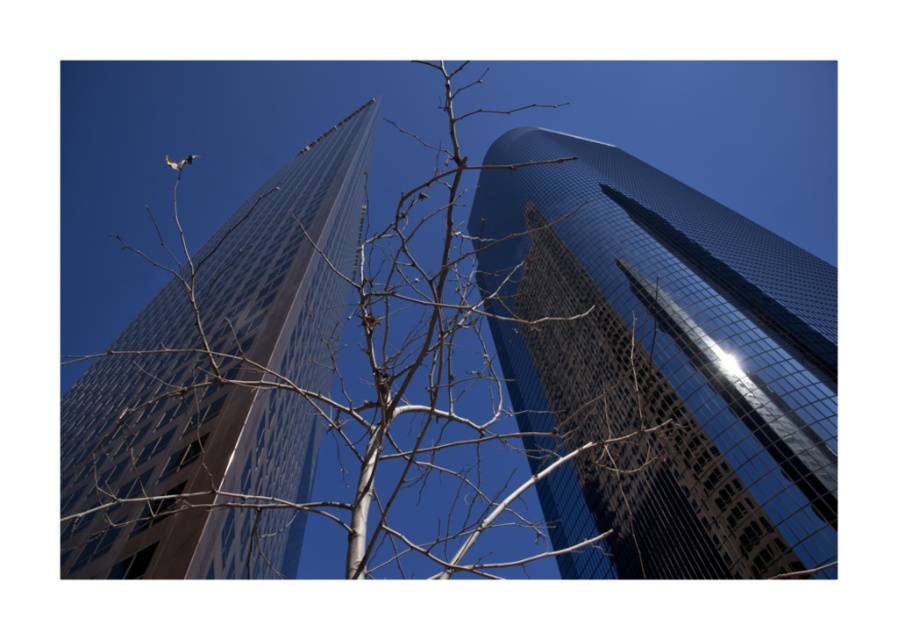
You are a bird flying at an altitude of 10 meters above the ground. You want to land on the nearest object between the bare branches at center and the glossy glass skyscraper at center. Which object should you choose?

The bare branches at center is 14.17 meters away from the glossy glass skyscraper at center. Since you are flying at 10 meters altitude, the distance to the skyscraper would be greater than 14.17 meters, so the nearest object is the bare branches at center.

You are a bird looking for a place to perch. You see the bare branches at center and the glossy glass tower at left. Which one is closer to the ground?

The bare branches at center is closer to the ground because it is positioned below the glossy glass tower at left.

You are an urban planner analyzing the layout of this city scene. You notice the bare branches at center and the glossy glass skyscraper at center. Based on their positions, which object is closer to the left edge of the image?

The bare branches at center are to the left of the glossy glass skyscraper at center, so they are closer to the left edge of the image.